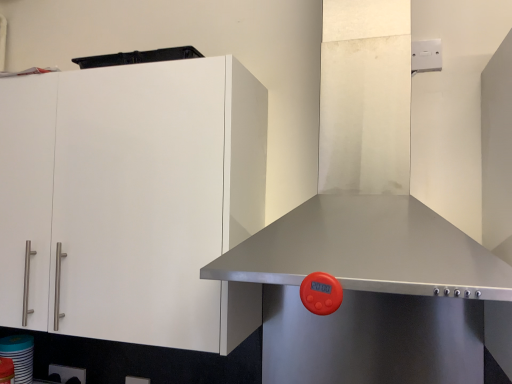
The image size is (512, 384). What do you see at coordinates (132, 200) in the screenshot?
I see `white matte cabinet at left` at bounding box center [132, 200].

Describe the element at coordinates (19, 356) in the screenshot. This screenshot has width=512, height=384. I see `white glossy cup at lower left` at that location.

Where is `stainless steel exhaust hood at center`? Image resolution: width=512 pixels, height=384 pixels. stainless steel exhaust hood at center is located at coordinates (408, 100).

Who is bigger, white glossy cup at lower left or white matte cabinet at left?

With larger size is white matte cabinet at left.

Based on the photo, from their relative heights in the image, would you say white glossy cup at lower left is taller or shorter than white matte cabinet at left?

Considering their sizes, white glossy cup at lower left has less height than white matte cabinet at left.

Does point (20, 368) appear closer or farther from the camera than point (22, 191)?

Clearly, point (20, 368) is more distant from the camera than point (22, 191).

Is white glossy cup at lower left oriented towards white matte cabinet at left?

No, white glossy cup at lower left is not turned towards white matte cabinet at left.

Is stainless steel exhaust hood at center turned away from white matte cabinet at left?

No.

From the image's perspective, is stainless steel exhaust hood at center located above white matte cabinet at left?

Yes, from the image's perspective, stainless steel exhaust hood at center is over white matte cabinet at left.

Which is in front, stainless steel exhaust hood at center or white matte cabinet at left?

stainless steel exhaust hood at center is in front.

Considering the positions of objects white matte cabinet at left and white glossy cup at lower left in the image provided, who is more to the left, white matte cabinet at left or white glossy cup at lower left?

white glossy cup at lower left.

Is there a large distance between white matte cabinet at left and white glossy cup at lower left?

white matte cabinet at left is near white glossy cup at lower left, not far away.

Between point (162, 225) and point (24, 381), which one is positioned in front?

Point (162, 225)

Which of these two, white matte cabinet at left or white glossy cup at lower left, stands shorter?

white glossy cup at lower left.

Consider the image. In the image, is white glossy cup at lower left positioned in front of or behind stainless steel exhaust hood at center?

Visually, white glossy cup at lower left is located behind stainless steel exhaust hood at center.

Does white glossy cup at lower left appear on the left side of stainless steel exhaust hood at center?

Yes.

Do you think white glossy cup at lower left is within stainless steel exhaust hood at center, or outside of it?

white glossy cup at lower left is outside stainless steel exhaust hood at center.

From the image's perspective, does white glossy cup at lower left appear higher than stainless steel exhaust hood at center?

No, from the image's perspective, white glossy cup at lower left is not above stainless steel exhaust hood at center.

From the image's perspective, which object appears higher, stainless steel exhaust hood at center or white glossy cup at lower left?

From the image's view, stainless steel exhaust hood at center is above.

Can you confirm if stainless steel exhaust hood at center is taller than white glossy cup at lower left?

Correct, stainless steel exhaust hood at center is much taller as white glossy cup at lower left.

In the scene shown: Considering the relative sizes of stainless steel exhaust hood at center and white glossy cup at lower left in the image provided, is stainless steel exhaust hood at center wider than white glossy cup at lower left?

Correct, the width of stainless steel exhaust hood at center exceeds that of white glossy cup at lower left.

Does stainless steel exhaust hood at center have a smaller size compared to white glossy cup at lower left?

Actually, stainless steel exhaust hood at center might be larger than white glossy cup at lower left.

Is white matte cabinet at left in contact with stainless steel exhaust hood at center?

No, white matte cabinet at left is not next to stainless steel exhaust hood at center.

Which of these two, white matte cabinet at left or stainless steel exhaust hood at center, stands taller?

With more height is stainless steel exhaust hood at center.

Find the location of a particular element. cabinetry on the left of stainless steel exhaust hood at center is located at coordinates point(132,200).

From a real-world perspective, which object stands above the other?

From a 3D spatial view, stainless steel exhaust hood at center is above.

You are a GUI agent. You are given a task and a screenshot of the screen. Output one action in this format:
    pyautogui.click(x=<x>, y=<y>)
    Task: Click on the cabinetry located above the white glossy cup at lower left (from a real-world perspective)
    This screenshot has height=384, width=512.
    Given the screenshot: What is the action you would take?
    pyautogui.click(x=132, y=200)

Find the location of a particular element. Image resolution: width=512 pixels, height=384 pixels. cabinetry directly beneath the stainless steel exhaust hood at center (from a real-world perspective) is located at coordinates (132, 200).

Consider the image. Looking at the image, which one is located further to white matte cabinet at left, stainless steel exhaust hood at center or white glossy cup at lower left?

Based on the image, white glossy cup at lower left appears to be further to white matte cabinet at left.

When comparing their distances from white matte cabinet at left, does white glossy cup at lower left or stainless steel exhaust hood at center seem further?

Among the two, white glossy cup at lower left is located further to white matte cabinet at left.

Based on their spatial positions, is stainless steel exhaust hood at center or white matte cabinet at left further from white glossy cup at lower left?

Based on the image, stainless steel exhaust hood at center appears to be further to white glossy cup at lower left.

Based on their spatial positions, is white matte cabinet at left or stainless steel exhaust hood at center closer to white glossy cup at lower left?

Among the two, white matte cabinet at left is located nearer to white glossy cup at lower left.

Based on their spatial positions, is white matte cabinet at left or white glossy cup at lower left closer to stainless steel exhaust hood at center?

white matte cabinet at left is positioned closer to the anchor stainless steel exhaust hood at center.

Considering their positions, is white glossy cup at lower left positioned closer to stainless steel exhaust hood at center than white matte cabinet at left?

white matte cabinet at left is closer to stainless steel exhaust hood at center.

Where is `cabinetry between white glossy cup at lower left and stainless steel exhaust hood at center from left to right`? This screenshot has width=512, height=384. cabinetry between white glossy cup at lower left and stainless steel exhaust hood at center from left to right is located at coordinates (132, 200).